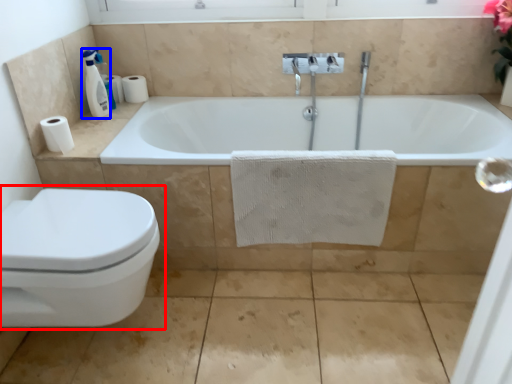
Question: Which point is closer to the camera, toilet (highlighted by a red box) or soap dispenser (highlighted by a blue box)?

Choices:
 (A) toilet
 (B) soap dispenser

Answer: (A)